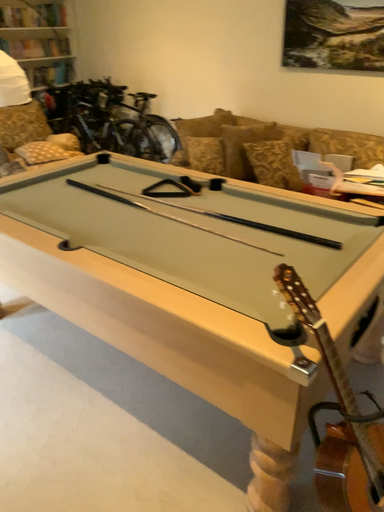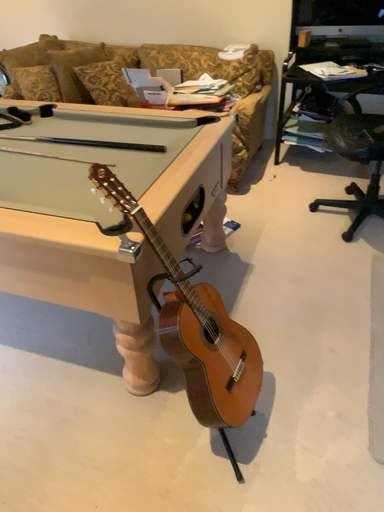
Question: How did the camera likely rotate when shooting the video?

Choices:
 (A) rotated downward
 (B) rotated upward

Answer: (A)